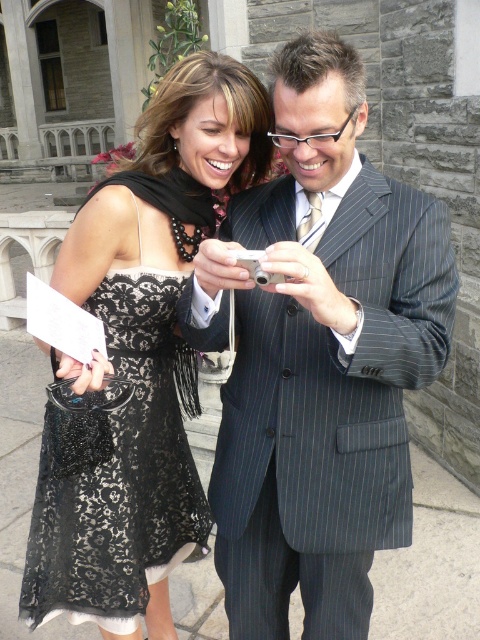
Is pinstriped suit at center positioned in front of black lace dress at center?

Yes, pinstriped suit at center is in front of black lace dress at center.

Is point (453, 296) more distant than point (103, 634)?

No, it is not.

Locate an element on the screen. Image resolution: width=480 pixels, height=640 pixels. pinstriped suit at center is located at coordinates (319, 356).